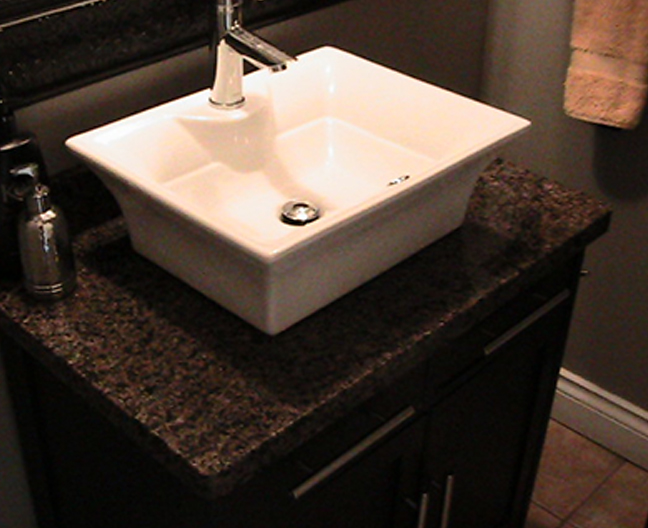
What are the coordinates of `silver handle` in the screenshot? It's located at (526, 329), (361, 454), (428, 510), (448, 491).